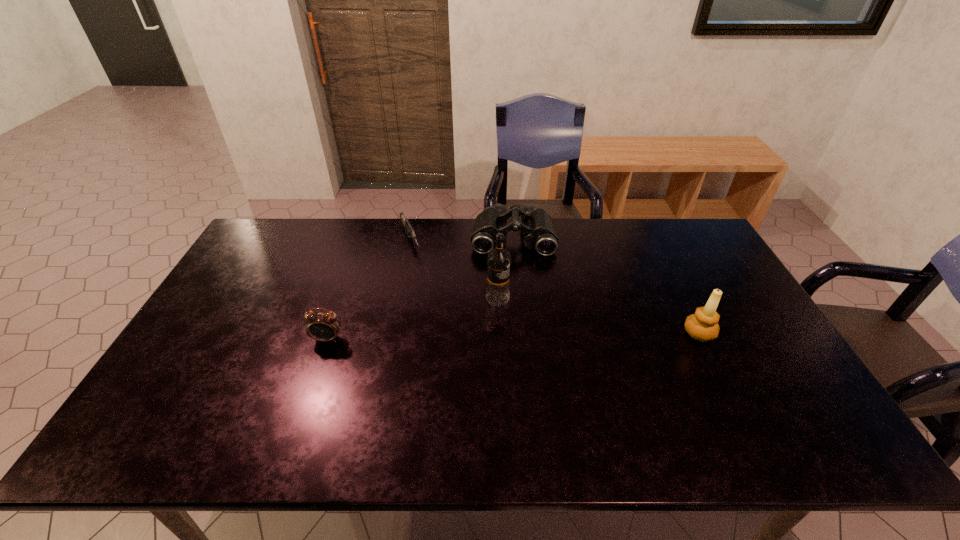
Locate an element on the screen. The height and width of the screenshot is (540, 960). vacant area between the fourth shortest object and the tallest object is located at coordinates (598, 316).

Image resolution: width=960 pixels, height=540 pixels. I want to click on free space between the fourth shortest object and the tallest object, so click(598, 316).

Find the location of `vacant area between the fourth shortest object and the shortest object`. vacant area between the fourth shortest object and the shortest object is located at coordinates tap(555, 286).

You are a GUI agent. You are given a task and a screenshot of the screen. Output one action in this format:
    pyautogui.click(x=<x>, y=<y>)
    Task: Click on the empty location between the candle_holder and the binoculars
    The height and width of the screenshot is (540, 960).
    Given the screenshot: What is the action you would take?
    pyautogui.click(x=606, y=285)

The width and height of the screenshot is (960, 540). I want to click on free point between the second object from left to right and the leftmost object, so click(x=369, y=289).

Locate an element on the screen. This screenshot has width=960, height=540. unoccupied area between the rightmost object and the second object from left to right is located at coordinates (555, 286).

Locate an element on the screen. The image size is (960, 540). object that ranks as the fourth closest to the binoculars is located at coordinates (322, 326).

Identify which object is located as the second nearest to the fourth object from right to left. Please provide its 2D coordinates. Your answer should be formatted as a tuple, i.e. [(x, y)], where the tuple contains the x and y coordinates of a point satisfying the conditions above.

[(498, 260)]